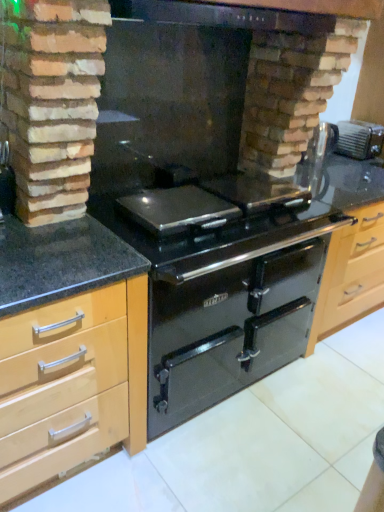
Question: Would you say glossy black oven at center is to the left or to the right of light wood/wooden cabinet at left in the picture?

Choices:
 (A) right
 (B) left

Answer: (A)

Question: Considering the positions of point (276, 353) and point (125, 406), is point (276, 353) closer or farther from the camera than point (125, 406)?

Choices:
 (A) farther
 (B) closer

Answer: (A)

Question: Which of these objects is positioned farthest from the black granite countertop at center?

Choices:
 (A) black glass fireplace at center
 (B) light wood/wooden cabinet at left
 (C) black glass exhaust hood at upper center
 (D) metallic silver toaster at upper right
 (E) glossy black oven at center

Answer: (D)

Question: Which object is positioned closest to the light wood/wooden cabinet at left?

Choices:
 (A) metallic silver toaster at upper right
 (B) black granite countertop at center
 (C) glossy black oven at center
 (D) black glass fireplace at center
 (E) black glass exhaust hood at upper center

Answer: (B)